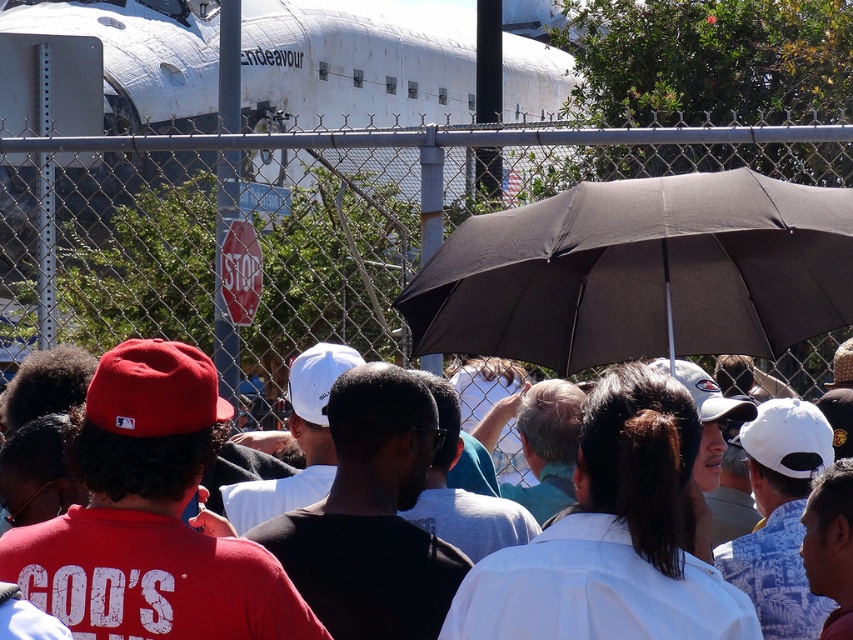
Question: Is metallic chain-link fence at center closer to the viewer compared to black matte umbrella at center?

Choices:
 (A) no
 (B) yes

Answer: (A)

Question: Can you confirm if metallic chain-link fence at center is positioned below black matte umbrella at center?

Choices:
 (A) no
 (B) yes

Answer: (A)

Question: Which object appears farthest from the camera in this image?

Choices:
 (A) metallic chain-link fence at center
 (B) black matte umbrella at center

Answer: (A)

Question: Is metallic chain-link fence at center further to the viewer compared to black matte umbrella at center?

Choices:
 (A) yes
 (B) no

Answer: (A)

Question: Among these points, which one is farthest from the camera?

Choices:
 (A) (173, 308)
 (B) (621, 301)

Answer: (A)